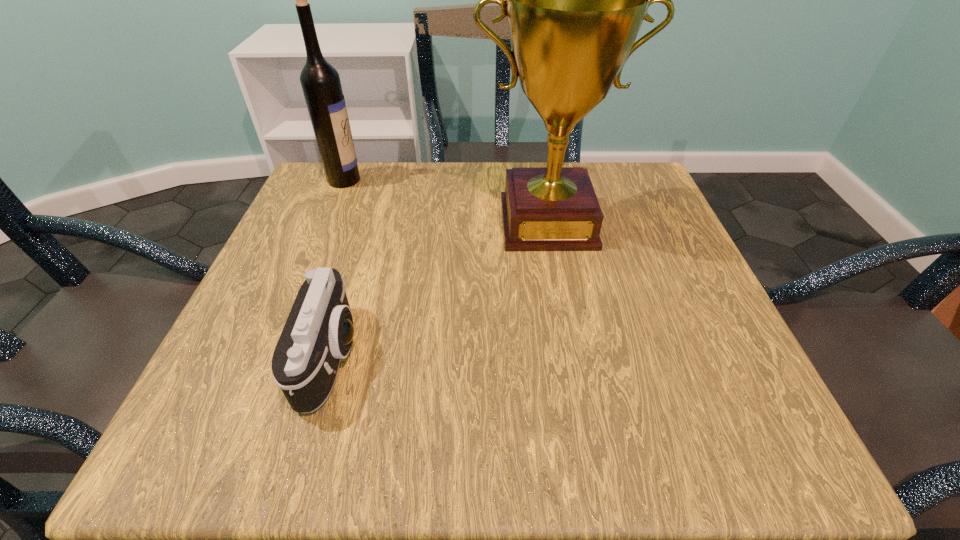
At what (x,y) coordinates should I click in order to perform the action: click on vacant space that's between the shortest object and the wine bottle. Please return your answer as a coordinate pair (x, y). Looking at the image, I should click on (338, 268).

Identify the location of blank region between the rightmost object and the farthest object. This screenshot has width=960, height=540. (445, 201).

This screenshot has width=960, height=540. Identify the location of vacant space that is in between the second object from left to right and the second farthest object. (440, 289).

Where is `vacant region between the nearest object and the award`? Image resolution: width=960 pixels, height=540 pixels. vacant region between the nearest object and the award is located at coordinates (440, 289).

Find the location of a particular element. Image resolution: width=960 pixels, height=540 pixels. empty space between the rightmost object and the shortest object is located at coordinates (440, 289).

Where is `object that ranks as the closest to the second nearest object`? object that ranks as the closest to the second nearest object is located at coordinates (318, 332).

The width and height of the screenshot is (960, 540). I want to click on object that is the second closest to the leftmost object, so click(x=318, y=332).

The width and height of the screenshot is (960, 540). What are the coordinates of `free location that satisfies the following two spatial constraints: 1. on the plaque of the second nearest object; 2. on the front lens of the nearest object` in the screenshot? It's located at (572, 356).

Where is `blank area in the image that satisfies the following two spatial constraints: 1. on the plaque of the award; 2. on the front lens of the second object from left to right`? The width and height of the screenshot is (960, 540). blank area in the image that satisfies the following two spatial constraints: 1. on the plaque of the award; 2. on the front lens of the second object from left to right is located at coordinates (572, 356).

Identify the location of vacant area in the image that satisfies the following two spatial constraints: 1. on the plaque of the rightmost object; 2. on the front lens of the shortest object. This screenshot has height=540, width=960. (572, 356).